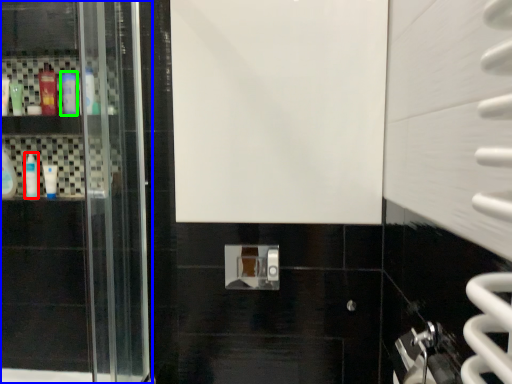
Question: Considering the real-world distances, which object is farthest from mouthwash (highlighted by a red box)? door (highlighted by a blue box) or mouthwash (highlighted by a green box)?

Choices:
 (A) door
 (B) mouthwash

Answer: (A)